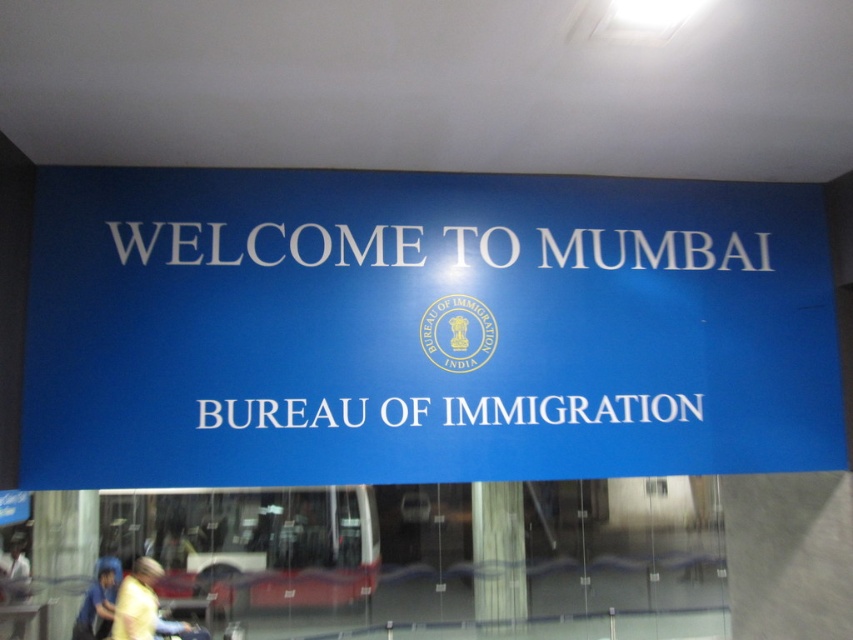
You are standing in front of the Bureau of Immigration signboard and notice two points marked on it. One is at coordinates point [454,417] and the other at point [84,627]. Which point is closer to your eyes?

Point [454,417] is closer to the camera than point [84,627], so the point at coordinates point [454,417] is closer to your eyes.

You are standing in front of the large blue signboard with white text and a logo. There is a specific point marked at coordinates point (268, 244). Which object on the signboard is exactly at that point?

The white matte text at upper center is located at point (268, 244).

You are a photographer setting up a shot of the signboard. You need to decide whether to include both the white glossy pillar at center and the blue fabric at lower left in your frame. Based on their widths, which object should you prioritize including if you can only fit one due to space constraints?

The white glossy pillar at center might be wider than blue fabric at lower left, so you should prioritize including the white glossy pillar at center in the frame to ensure it fits properly.